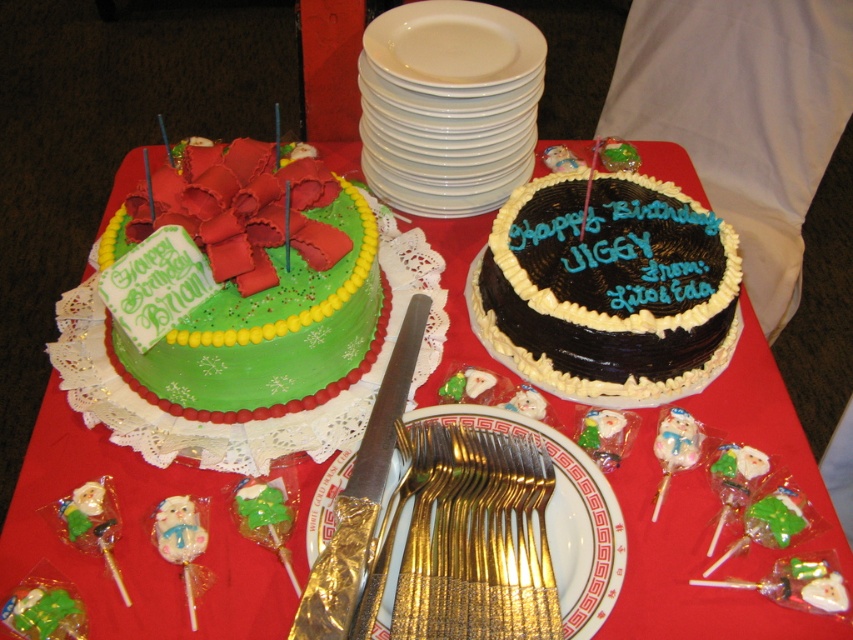
From the picture: You are a guest at the birthday party and want to reach the gold plated forks at center to serve yourself cake. Given that you are standing at the edge of the table, which direction should you move to find the forks?

The gold plated forks at center are located at point coordinates, so you should move towards the center of the table to reach them.

You are a guest at the birthday party and want to choose a dessert plate that matches the size of the chocolate frosted cake at center. The white glossy plate at upper center is available. Based on their sizes, which plate would be appropriate?

The chocolate frosted cake at center has a smaller size compared to the white glossy plate at upper center. Therefore, the white glossy plate at upper center is too large for the chocolate frosted cake at center. A smaller plate would be more appropriate.

You are a guest at the birthday party and want to grab a plate to serve yourself cake. Which object should you take first, the chocolate frosted cake at center or the white glossy plate at upper center?

You should take the white glossy plate at upper center first because the chocolate frosted cake at center is located below it, so you need to access the plate before reaching the cake.